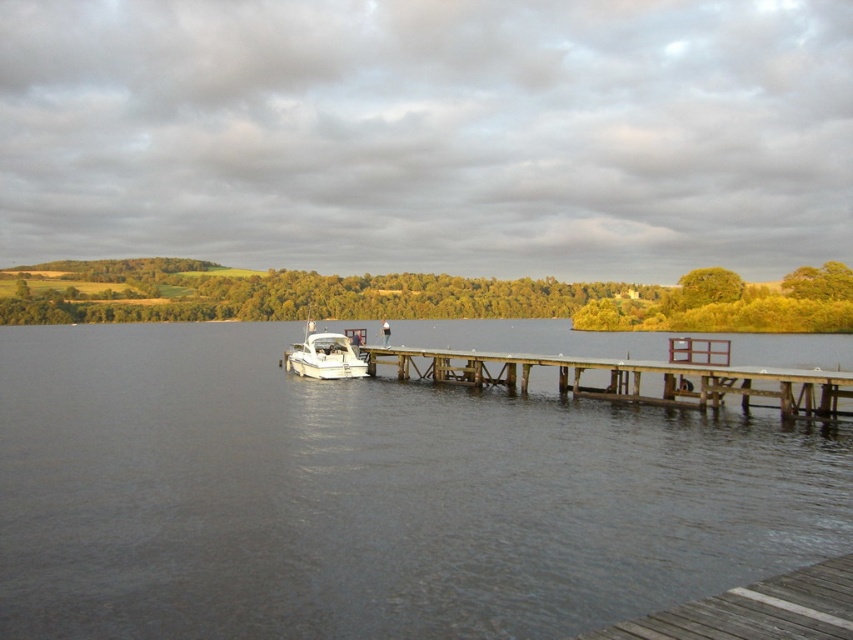
You are standing on the wooden jetty and want to locate the clear water at dock center. According to the coordinates provided, where should you look relative to the jetty?

The clear water at dock center is located at coordinates point (x=370, y=497), so you should look towards the center of the dock where the coordinates indicate the position of the clear water.

You are standing at the edge of the lake and want to walk towards the wooden jetty. Which point, point 1 at coordinates point [583,600] or point 2 at coordinates point [306,348], will you reach first?

You will reach point 1 at coordinates point [583,600] first because it is closer to you than point 2 at coordinates point [306,348].

You are a swimmer who wants to jump into the water near the wooden dock at center. Considering the clear water at dock center, will you have enough depth to dive safely?

The clear water at dock center is shorter than the wooden dock at center, which means the water depth there may not be sufficient for a safe dive. It is advisable to look for a deeper area away from the wooden dock at center.